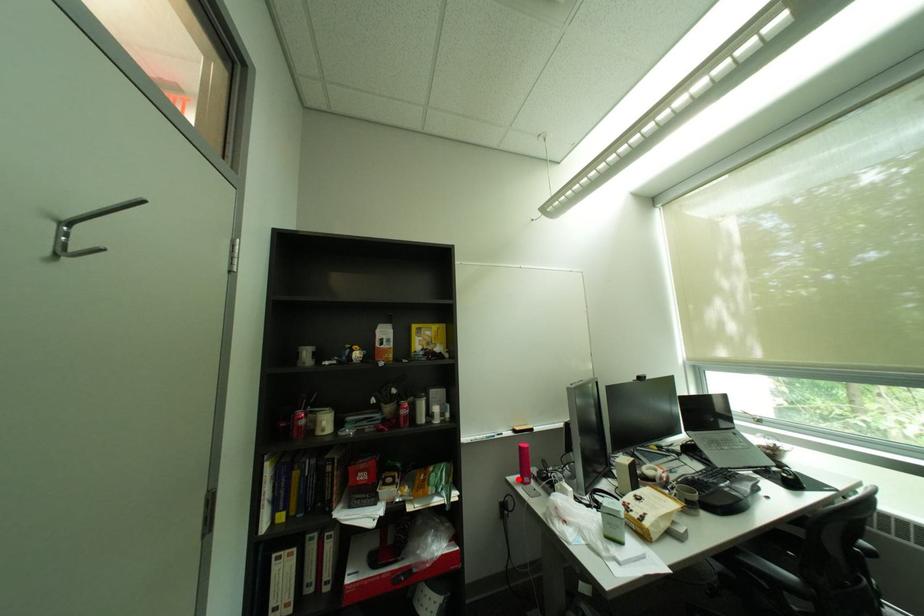
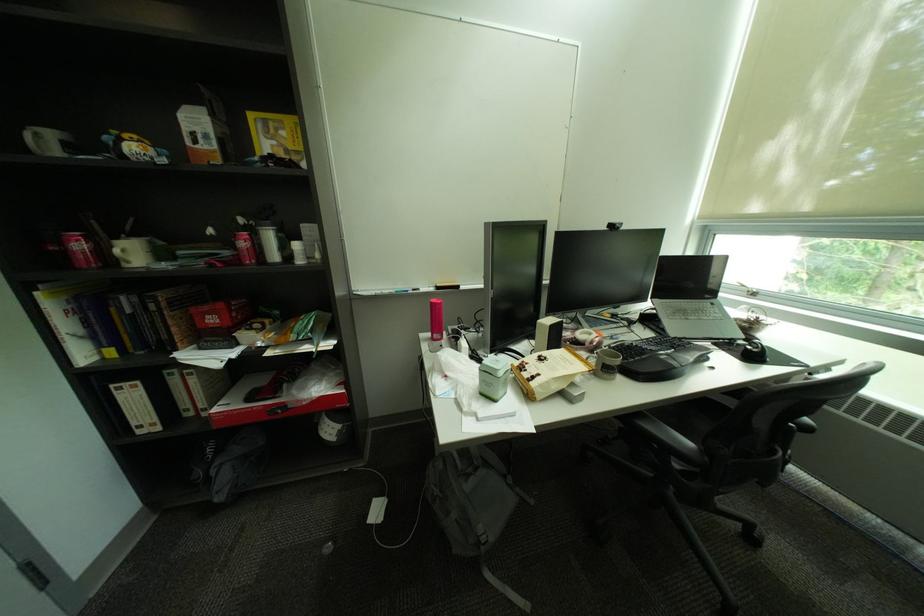
Question: I am providing you with two images of the same scene from different viewpoints. A red point is shown in image1. For the corresponding object point in image2, is it positioned nearer or farther from the camera?

Choices:
 (A) Nearer
 (B) Farther

Answer: (A)